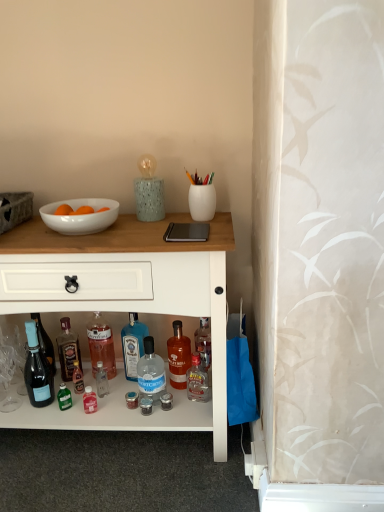
Question: Can you confirm if clear glass bottle at center, which ranks as the 2th bottle in left-to-right order, is bigger than white glossy cabinet at center?

Choices:
 (A) yes
 (B) no

Answer: (B)

Question: From the image's perspective, would you say clear glass bottle at center, which is the fourth bottle from right to left, is shown under white glossy cabinet at center?

Choices:
 (A) no
 (B) yes

Answer: (B)

Question: Is clear glass bottle at center, which ranks as the 2th bottle in left-to-right order, positioned before white glossy cabinet at center?

Choices:
 (A) no
 (B) yes

Answer: (A)

Question: Is clear glass bottle at center, which is the fourth bottle from right to left, with white glossy cabinet at center?

Choices:
 (A) no
 (B) yes

Answer: (A)

Question: Is clear glass bottle at center, which is the fourth bottle from right to left, at the left side of white glossy cabinet at center?

Choices:
 (A) yes
 (B) no

Answer: (A)

Question: Is point (172, 344) closer or farther from the camera than point (122, 330)?

Choices:
 (A) closer
 (B) farther

Answer: (A)

Question: From a real-world perspective, relative to blue glass bottle at center, the 3th bottle viewed from the right, is translucent amber glass bottle at center, which is the first bottle in right-to-left order, vertically above or below?

Choices:
 (A) below
 (B) above

Answer: (A)

Question: In the image, is translucent amber glass bottle at center, which ranks as the fifth bottle in left-to-right order, positioned in front of or behind blue glass bottle at center, the 3th bottle viewed from the right?

Choices:
 (A) behind
 (B) front

Answer: (B)

Question: Considering the relative positions of translucent amber glass bottle at center, which is the first bottle in right-to-left order, and blue glass bottle at center, which is counted as the 3th bottle, starting from the left, in the image provided, is translucent amber glass bottle at center, which is the first bottle in right-to-left order, to the left or to the right of blue glass bottle at center, which is counted as the 3th bottle, starting from the left,?

Choices:
 (A) left
 (B) right

Answer: (B)

Question: Is clear glass bottle at center, which is counted as the 2th bottle, starting from the right, in front of or behind white glossy cabinet at center in the image?

Choices:
 (A) behind
 (B) front

Answer: (A)

Question: Based on their sizes in the image, would you say clear glass bottle at center, placed as the 4th bottle when sorted from left to right, is bigger or smaller than white glossy cabinet at center?

Choices:
 (A) small
 (B) big

Answer: (A)

Question: Considering the positions of clear glass bottle at center, placed as the 4th bottle when sorted from left to right, and white glossy cabinet at center in the image, is clear glass bottle at center, placed as the 4th bottle when sorted from left to right, taller or shorter than white glossy cabinet at center?

Choices:
 (A) tall
 (B) short

Answer: (B)

Question: Considering the relative positions of clear glass bottle at center, placed as the 4th bottle when sorted from left to right, and white glossy cabinet at center in the image provided, is clear glass bottle at center, placed as the 4th bottle when sorted from left to right, to the left or to the right of white glossy cabinet at center?

Choices:
 (A) left
 (B) right

Answer: (B)

Question: Looking at their shapes, would you say clear glass bottle at center, which ranks as the 2th bottle in left-to-right order, is wider or thinner than blue glass bottle at center, which is counted as the 3th bottle, starting from the left?

Choices:
 (A) thin
 (B) wide

Answer: (A)

Question: Do you think clear glass bottle at center, which is the fourth bottle from right to left, is within blue glass bottle at center, which is counted as the 3th bottle, starting from the left, or outside of it?

Choices:
 (A) inside
 (B) outside

Answer: (B)